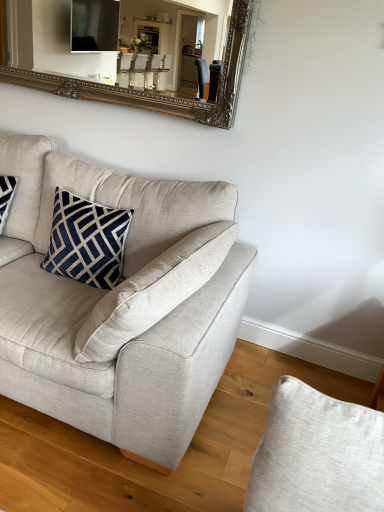
What is the approximate width of light beige fabric couch at center?

It is 1.07 meters.

Measure the distance between point (47, 54) and camera.

Point (47, 54) is 4.76 meters from camera.

In order to face navy blue fabric pillow at upper left, should I rotate leftwards or rightwards?

Turn left by 13.955 degrees to look at navy blue fabric pillow at upper left.

Where is `light beige fabric couch at center`? The height and width of the screenshot is (512, 384). light beige fabric couch at center is located at coordinates (121, 304).

Is silver/gilded mirror at upper center completely or partially inside navy blue fabric pillow at upper left?

No, silver/gilded mirror at upper center is not a part of navy blue fabric pillow at upper left.

Is there a large distance between navy blue fabric pillow at upper left and silver/gilded mirror at upper center?

navy blue fabric pillow at upper left is positioned a significant distance from silver/gilded mirror at upper center.

How many degrees apart are the facing directions of navy blue fabric pillow at upper left and silver/gilded mirror at upper center?

They differ by 0.169 degrees in their facing directions.

From their relative heights in the image, would you say navy blue fabric pillow at upper left is taller or shorter than silver/gilded mirror at upper center?

In the image, navy blue fabric pillow at upper left appears to be shorter than silver/gilded mirror at upper center.

Based on the photo, are light beige fabric couch at center and navy blue fabric pillow at upper left making contact?

No, light beige fabric couch at center is not making contact with navy blue fabric pillow at upper left.

Which is more to the left, light beige fabric couch at center or navy blue fabric pillow at upper left?

light beige fabric couch at center.

From the image's perspective, is light beige fabric couch at center located above or below navy blue fabric pillow at upper left?

From the image's perspective, light beige fabric couch at center appears below navy blue fabric pillow at upper left.

From a real-world perspective, is light beige fabric couch at center positioned over navy blue fabric pillow at upper left based on gravity?

No, from a real-world perspective, light beige fabric couch at center is not on top of navy blue fabric pillow at upper left.

From a real-world perspective, is silver/gilded mirror at upper center below light beige fabric couch at center?

Incorrect, from a real-world perspective, silver/gilded mirror at upper center is higher than light beige fabric couch at center.

Considering the points (173, 74) and (44, 216), which point is behind, point (173, 74) or point (44, 216)?

The point (173, 74) is more distant.

Is silver/gilded mirror at upper center bigger than light beige fabric couch at center?

Incorrect, silver/gilded mirror at upper center is not larger than light beige fabric couch at center.

What are the coordinates of `studio couch in front of the silver/gilded mirror at upper center` in the screenshot? It's located at (121, 304).

Is silver/gilded mirror at upper center surrounded by light beige fabric couch at center?

No.

Considering the positions of objects light beige fabric couch at center and silver/gilded mirror at upper center in the image provided, who is more to the right, light beige fabric couch at center or silver/gilded mirror at upper center?

silver/gilded mirror at upper center.

From a real-world perspective, is light beige fabric couch at center located higher than silver/gilded mirror at upper center?

Actually, light beige fabric couch at center is physically below silver/gilded mirror at upper center in the real world.

Considering their positions, is light beige fabric couch at center located in front of or behind silver/gilded mirror at upper center?

light beige fabric couch at center is in front of silver/gilded mirror at upper center.

Which is behind, silver/gilded mirror at upper center or navy blue fabric pillow at upper left?

silver/gilded mirror at upper center is behind.

Between silver/gilded mirror at upper center and navy blue fabric pillow at upper left, which one has more height?

Standing taller between the two is silver/gilded mirror at upper center.

How different are the orientations of silver/gilded mirror at upper center and navy blue fabric pillow at upper left in degrees?

silver/gilded mirror at upper center and navy blue fabric pillow at upper left are facing 0.169 degrees away from each other.

Is silver/gilded mirror at upper center facing away from navy blue fabric pillow at upper left?

No.

Does navy blue fabric pillow at upper left turn towards light beige fabric couch at center?

Yes, navy blue fabric pillow at upper left is facing light beige fabric couch at center.

How many degrees apart are the facing directions of navy blue fabric pillow at upper left and light beige fabric couch at center?

A: The angular difference between navy blue fabric pillow at upper left and light beige fabric couch at center is 0.00102 degrees.

Can you confirm if navy blue fabric pillow at upper left is shorter than light beige fabric couch at center?

Yes.

Considering the sizes of objects navy blue fabric pillow at upper left and light beige fabric couch at center in the image provided, who is thinner, navy blue fabric pillow at upper left or light beige fabric couch at center?

navy blue fabric pillow at upper left.

Identify the location of pillow directly beneath the silver/gilded mirror at upper center (from a real-world perspective). Image resolution: width=384 pixels, height=512 pixels. (87, 241).

What are the coordinates of `studio couch in front of the navy blue fabric pillow at upper left` in the screenshot? It's located at (121, 304).

From the image, which object appears to be farther from silver/gilded mirror at upper center, navy blue fabric pillow at upper left or light beige fabric couch at center?

Among the two, light beige fabric couch at center is located further to silver/gilded mirror at upper center.

Looking at the image, which one is located further to silver/gilded mirror at upper center, light beige fabric couch at center or navy blue fabric pillow at upper left?

Based on the image, light beige fabric couch at center appears to be further to silver/gilded mirror at upper center.

Based on their spatial positions, is silver/gilded mirror at upper center or navy blue fabric pillow at upper left further from light beige fabric couch at center?

Based on the image, silver/gilded mirror at upper center appears to be further to light beige fabric couch at center.

Which object lies further to the anchor point light beige fabric couch at center, navy blue fabric pillow at upper left or silver/gilded mirror at upper center?

The object further to light beige fabric couch at center is silver/gilded mirror at upper center.

Which object lies nearer to the anchor point navy blue fabric pillow at upper left, silver/gilded mirror at upper center or light beige fabric couch at center?

light beige fabric couch at center is positioned closer to the anchor navy blue fabric pillow at upper left.

Looking at the image, which one is located closer to navy blue fabric pillow at upper left, light beige fabric couch at center or silver/gilded mirror at upper center?

light beige fabric couch at center lies closer to navy blue fabric pillow at upper left than the other object.

I want to click on pillow between silver/gilded mirror at upper center and light beige fabric couch at center from top to bottom, so click(87, 241).